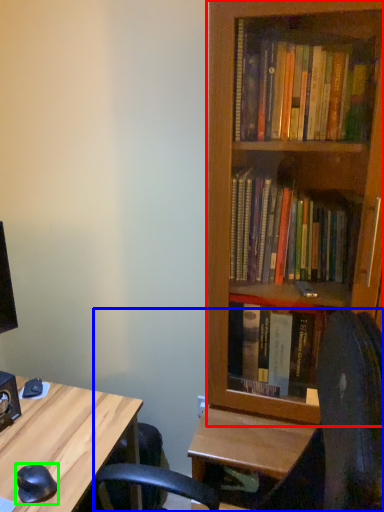
Question: Estimate the real-world distances between objects in this image. Which object is farther from bookcase (highlighted by a red box), computer chair (highlighted by a blue box) or mouse (highlighted by a green box)?

Choices:
 (A) computer chair
 (B) mouse

Answer: (B)